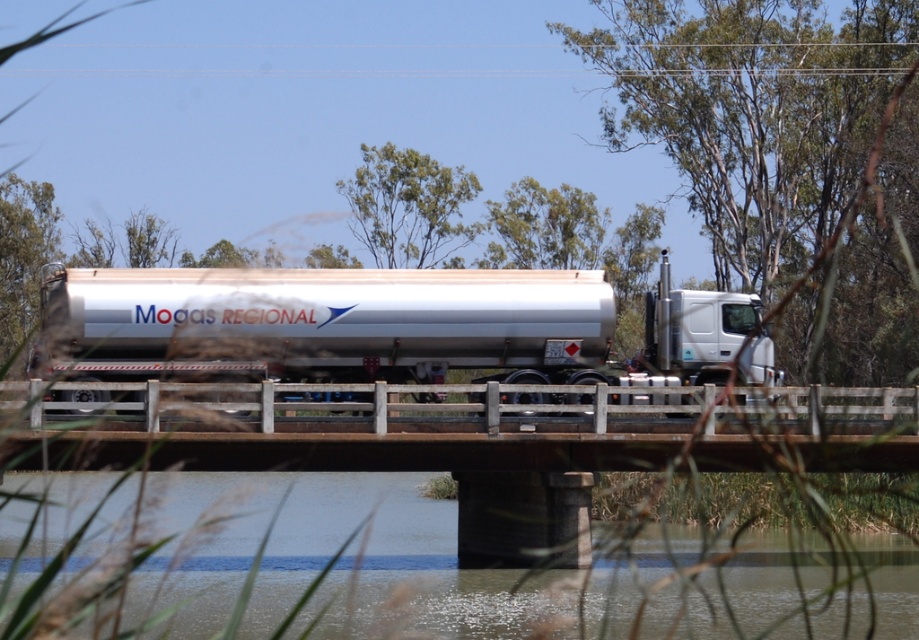
Is clear water at bridge center positioned before white glossy truck at center?

Yes, it is in front of white glossy truck at center.

Is point (634, 554) less distant than point (685, 372)?

No, (634, 554) is further to viewer.

The width and height of the screenshot is (919, 640). What do you see at coordinates (403, 564) in the screenshot? I see `clear water at bridge center` at bounding box center [403, 564].

Where is `clear water at bridge center`? Image resolution: width=919 pixels, height=640 pixels. clear water at bridge center is located at coordinates (403, 564).

Can you confirm if brushed metal trailer truck at center is positioned below white glossy truck at center?

No.

Is the position of brushed metal trailer truck at center less distant than that of white glossy truck at center?

Yes, it is in front of white glossy truck at center.

Who is more forward, (168, 321) or (755, 301)?

Positioned in front is point (168, 321).

At what (x,y) coordinates should I click in order to perform the action: click on brushed metal trailer truck at center. Please return your answer as a coordinate pair (x, y). This screenshot has width=919, height=640. Looking at the image, I should click on (323, 324).

Which of these two, concrete bridge at center or brushed metal trailer truck at center, stands taller?

concrete bridge at center

Which is in front, point (445, 456) or point (116, 269)?

Point (445, 456)

The image size is (919, 640). What do you see at coordinates (486, 445) in the screenshot? I see `concrete bridge at center` at bounding box center [486, 445].

The image size is (919, 640). I want to click on concrete bridge at center, so click(486, 445).